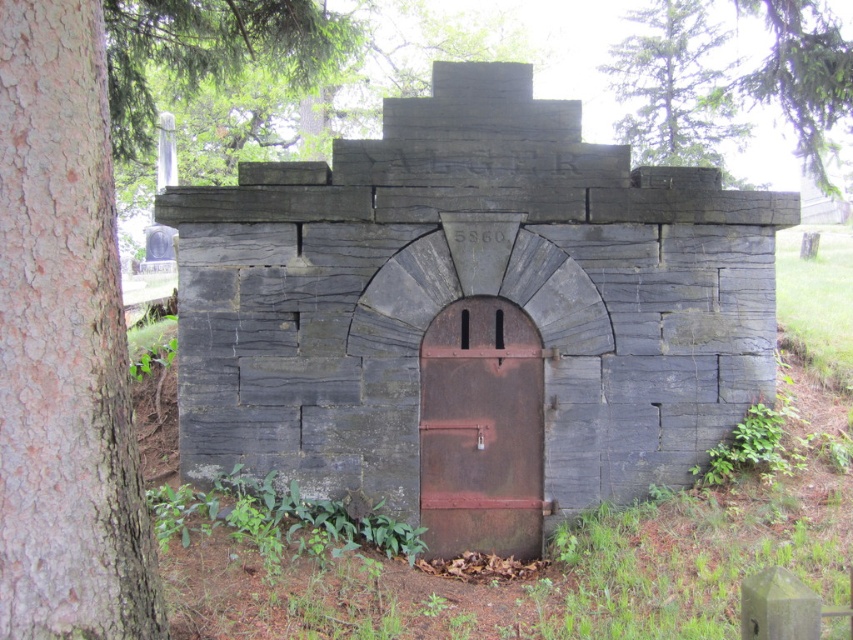
You are a gardener who needs to water two green leafy trees. The watering can you have can hold enough water to cover an area of 5 meters between two points. You are standing at the green leafy tree at upper center. Can you water the green leafy tree at upper right without moving the watering can?

The distance between the green leafy tree at upper center and the green leafy tree at upper right is 6.48 meters. Since the watering can can only cover 5 meters, you cannot water the green leafy tree at upper right without moving the watering can.

You are standing in front of the stone structure. There is a rusty metal door at center and a green leafy tree at upper center. Which object is positioned to the left of the other?

The rusty metal door at center is to the left of green leafy tree at upper center.

You are standing in front of the tomb and see two points marked on the structure. Which point is closer to you, point (496,337) or point (728,97)?

Point (496,337) is in front of point (728,97), so it is closer to you.